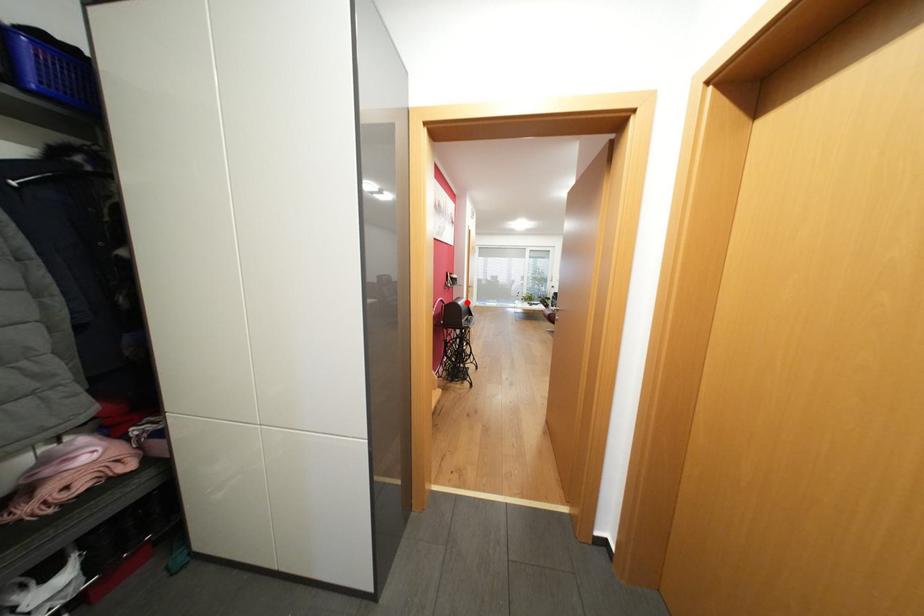
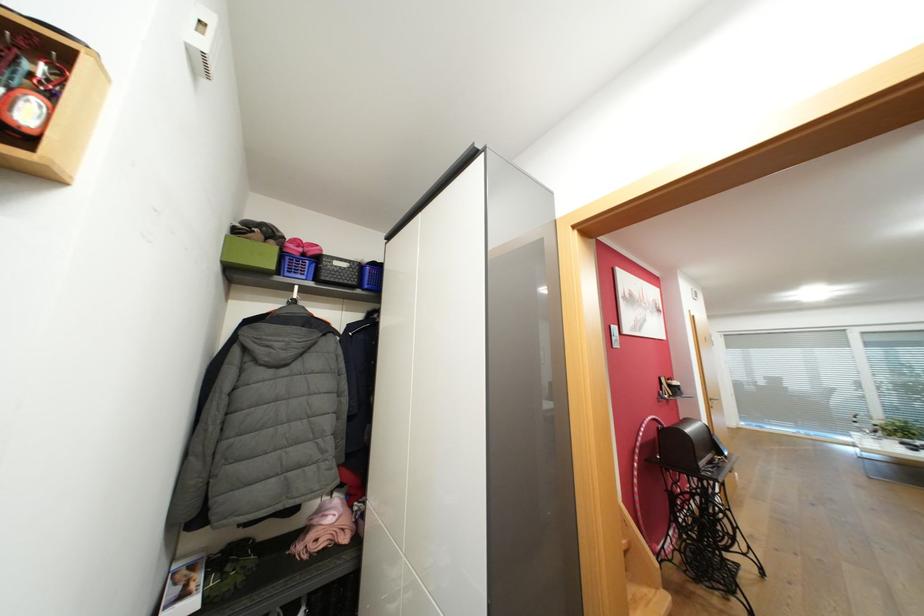
Find the pixel in the second image that matches the highlighted location in the first image.

(696, 430)